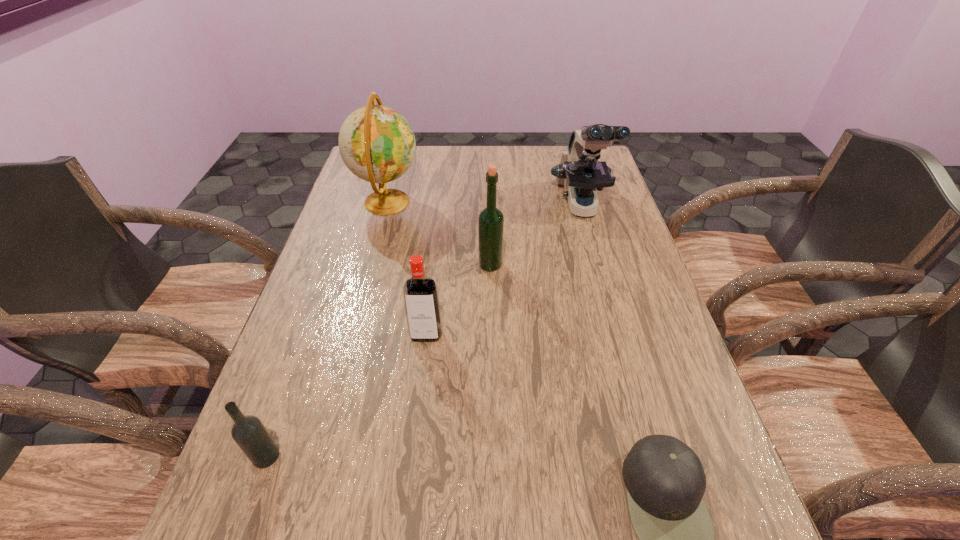
The width and height of the screenshot is (960, 540). Find the location of `free location located on the back of the third farthest object`. free location located on the back of the third farthest object is located at coordinates (489, 191).

The height and width of the screenshot is (540, 960). Find the location of `free space located on the front and back of the third nearest object`. free space located on the front and back of the third nearest object is located at coordinates (420, 382).

The image size is (960, 540). I want to click on vacant space located 0.250m on the right of the left vodka, so click(418, 456).

You are a GUI agent. You are given a task and a screenshot of the screen. Output one action in this format:
    pyautogui.click(x=<x>, y=<y>)
    Task: Click on the globe that is at the far edge
    The height and width of the screenshot is (540, 960).
    Given the screenshot: What is the action you would take?
    pyautogui.click(x=377, y=144)

Where is `microscope situated at the far edge`? This screenshot has height=540, width=960. microscope situated at the far edge is located at coordinates (580, 172).

The width and height of the screenshot is (960, 540). In order to click on globe present at the left edge in this screenshot , I will do `click(377, 144)`.

The width and height of the screenshot is (960, 540). In order to click on vodka situated at the left edge in this screenshot , I will do pos(249,433).

Where is `object that is at the right edge`? This screenshot has width=960, height=540. object that is at the right edge is located at coordinates (580, 172).

I want to click on object situated at the far left corner, so click(x=377, y=144).

Where is `object that is at the far right corner`? Image resolution: width=960 pixels, height=540 pixels. object that is at the far right corner is located at coordinates pyautogui.click(x=580, y=172).